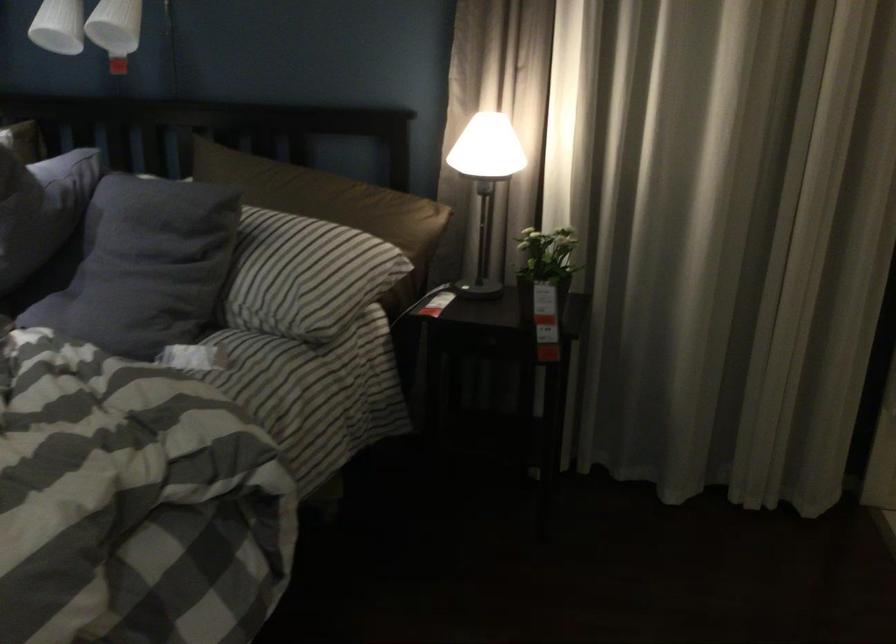
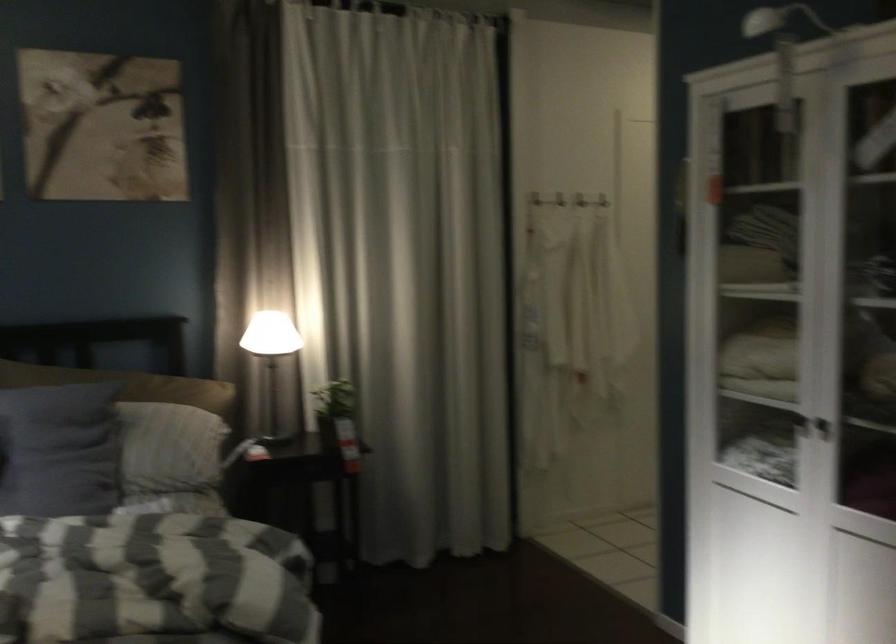
Find the pixel in the second image that matches point (297, 272) in the first image.

(173, 442)